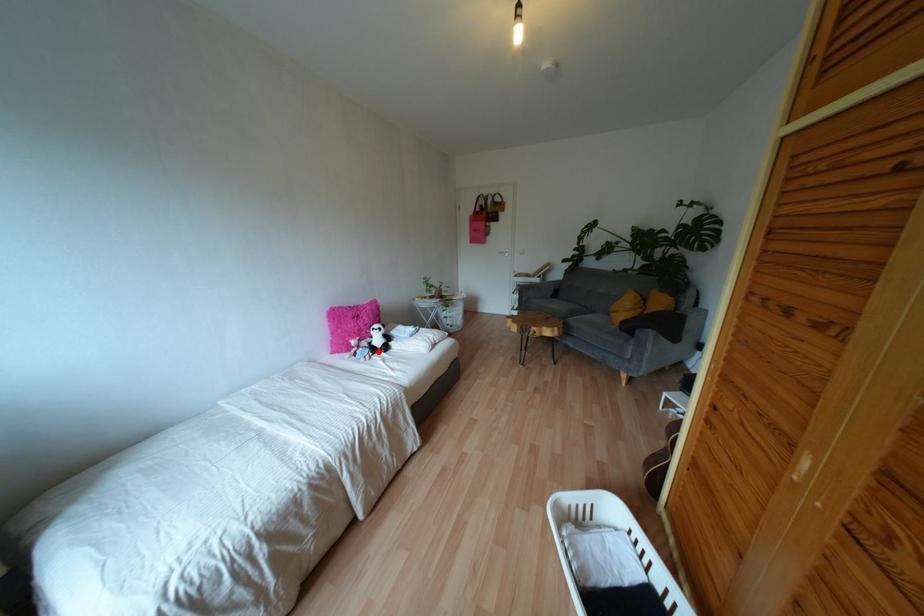
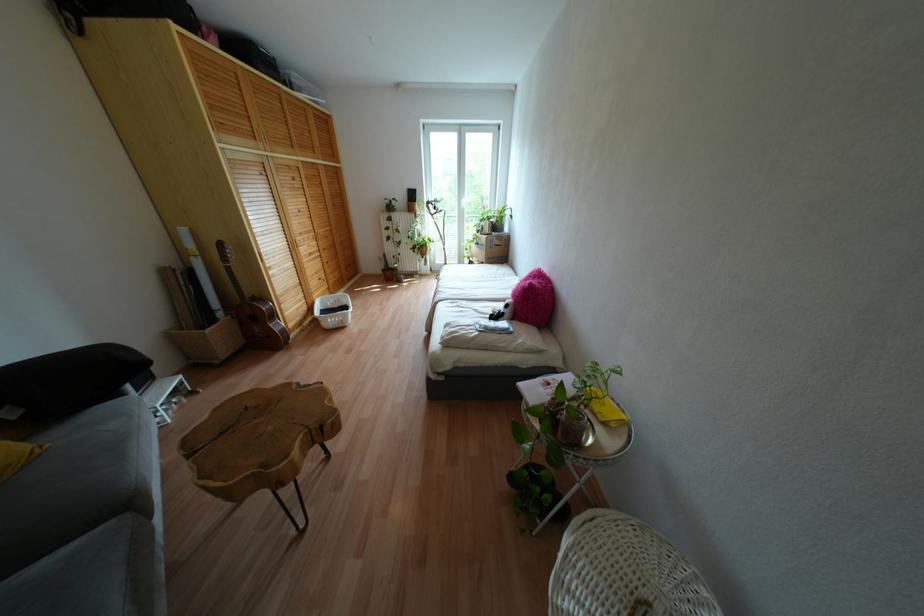
Question: I am providing you with two images of the same scene from different viewpoints. A red point is marked on the first image. At the location where the point appears in image 1, is it still visible in image 2?

Choices:
 (A) Yes
 (B) No

Answer: (B)